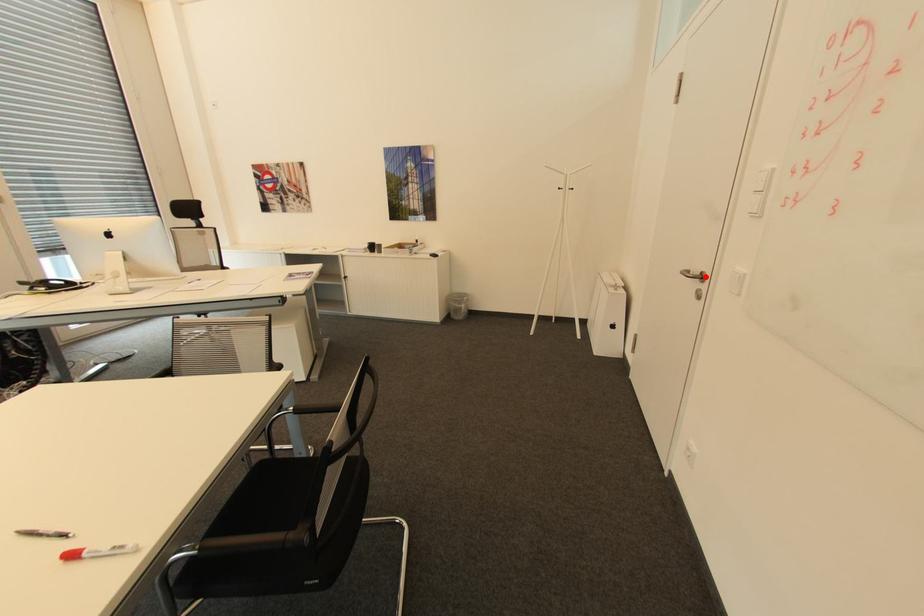
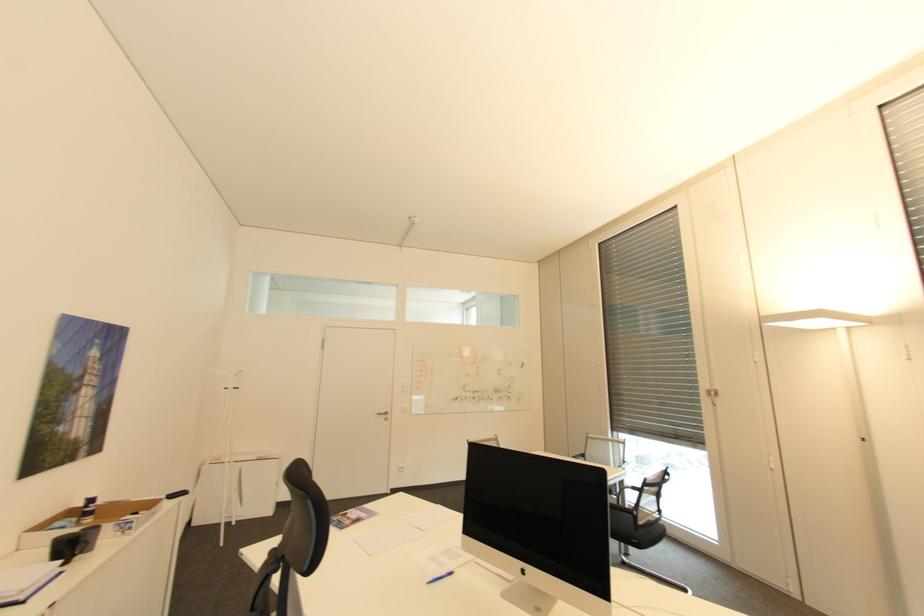
The point at the highlighted location is marked in the first image. Where is the corresponding point in the second image?

(391, 413)